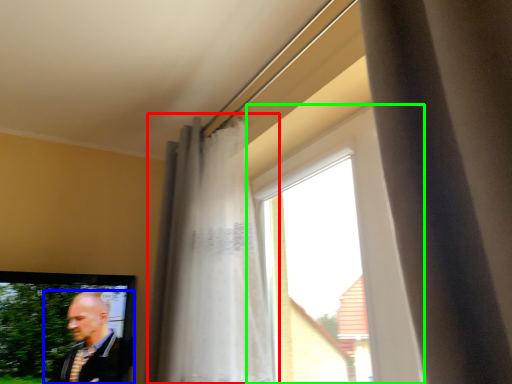
Question: Which object is the closest to the curtain (highlighted by a red box)? Choose among these: man (highlighted by a blue box) or window (highlighted by a green box).

Choices:
 (A) man
 (B) window

Answer: (B)